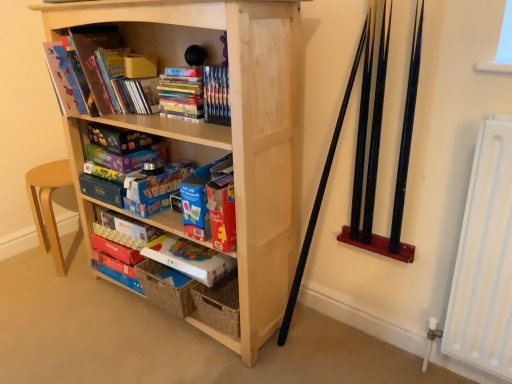
Question: Can you confirm if matte cardboard book at center, the 3th paperback book ordered from the bottom, is smaller than natural wood bookcase at center?

Choices:
 (A) no
 (B) yes

Answer: (B)

Question: Is matte cardboard book at center, the 3th paperback book ordered from the bottom, located outside natural wood bookcase at center?

Choices:
 (A) no
 (B) yes

Answer: (A)

Question: From a real-world perspective, is matte cardboard book at center, which is the 4th paperback book in top-to-bottom order, over natural wood bookcase at center?

Choices:
 (A) no
 (B) yes

Answer: (A)

Question: Considering the relative sizes of matte cardboard book at center, the 3th paperback book ordered from the bottom, and natural wood bookcase at center in the image provided, is matte cardboard book at center, the 3th paperback book ordered from the bottom, wider than natural wood bookcase at center?

Choices:
 (A) no
 (B) yes

Answer: (A)

Question: Is matte cardboard book at center, the 3th paperback book ordered from the bottom, to the right of natural wood bookcase at center from the viewer's perspective?

Choices:
 (A) no
 (B) yes

Answer: (A)

Question: Does matte cardboard book at center, which is the 4th paperback book in top-to-bottom order, lie in front of natural wood bookcase at center?

Choices:
 (A) no
 (B) yes

Answer: (A)

Question: Can matte blue board game at center, which appears as the first paperback book when viewed from the top, be found inside hardcover books at upper center, the first book in the right-to-left sequence?

Choices:
 (A) yes
 (B) no

Answer: (B)

Question: Is hardcover books at upper center, the first book in the right-to-left sequence, in contact with matte blue board game at center, the 6th paperback book when ordered from bottom to top?

Choices:
 (A) yes
 (B) no

Answer: (B)

Question: Can you confirm if hardcover books at upper center, the second book in the left-to-right sequence, is wider than matte blue board game at center, the 6th paperback book when ordered from bottom to top?

Choices:
 (A) no
 (B) yes

Answer: (A)

Question: Is hardcover books at upper center, the first book in the right-to-left sequence, shorter than matte blue board game at center, which appears as the first paperback book when viewed from the top?

Choices:
 (A) yes
 (B) no

Answer: (B)

Question: From a real-world perspective, is hardcover books at upper center, the second book in the left-to-right sequence, located beneath matte blue board game at center, the 6th paperback book when ordered from bottom to top?

Choices:
 (A) yes
 (B) no

Answer: (B)

Question: Is hardcover books at upper center, the first book in the right-to-left sequence, looking in the opposite direction of matte blue board game at center, which appears as the first paperback book when viewed from the top?

Choices:
 (A) no
 (B) yes

Answer: (A)

Question: Does white cardboard game box at center, the first paperback book when ordered from bottom to top, contain matte blue board game at center, the 6th paperback book when ordered from bottom to top?

Choices:
 (A) no
 (B) yes

Answer: (A)